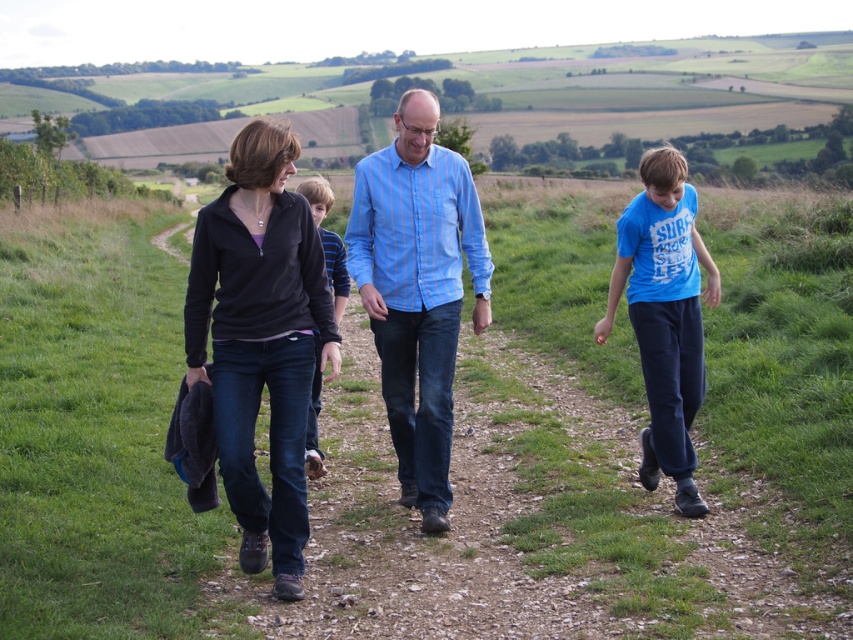
Does matte black jacket at left have a smaller size compared to blue cotton shirt at right?

Correct, matte black jacket at left occupies less space than blue cotton shirt at right.

Who is shorter, matte black jacket at left or blue cotton shirt at right?

With less height is matte black jacket at left.

Is point (442, 445) positioned before point (618, 282)?

Yes, it is in front of point (618, 282).

Identify the location of matte black jacket at left. The height and width of the screenshot is (640, 853). (416, 289).

Measure the distance from blue cotton shirt at right to striped cotton shirt at center.

blue cotton shirt at right and striped cotton shirt at center are 10.89 feet apart from each other.

Is blue cotton shirt at right wider than striped cotton shirt at center?

Incorrect, blue cotton shirt at right's width does not surpass striped cotton shirt at center's.

The image size is (853, 640). Find the location of `blue cotton shirt at right`. blue cotton shirt at right is located at coordinates (664, 316).

Is matte black jacket at center behind blue cotton shirt at right?

No, matte black jacket at center is closer to the viewer.

Between matte black jacket at center and blue cotton shirt at right, which one has less height?

Standing shorter between the two is blue cotton shirt at right.

Which is behind, point (250, 205) or point (666, 465)?

The point (666, 465) is behind.

At what (x,y) coordinates should I click in order to perform the action: click on matte black jacket at center. Please return your answer as a coordinate pair (x, y). This screenshot has width=853, height=640. Looking at the image, I should click on (260, 339).